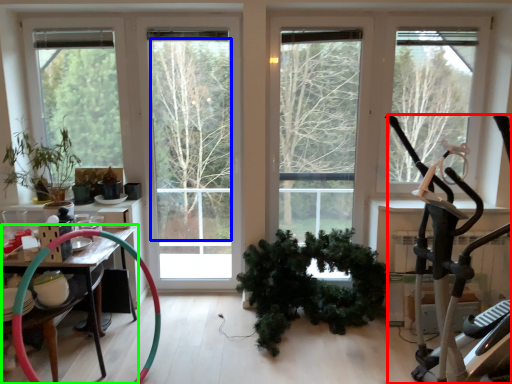
Question: Which object is the closest to the stationary bicycle (highlighted by a red box)? Choose among these: tree (highlighted by a blue box) or table (highlighted by a green box).

Choices:
 (A) tree
 (B) table

Answer: (B)